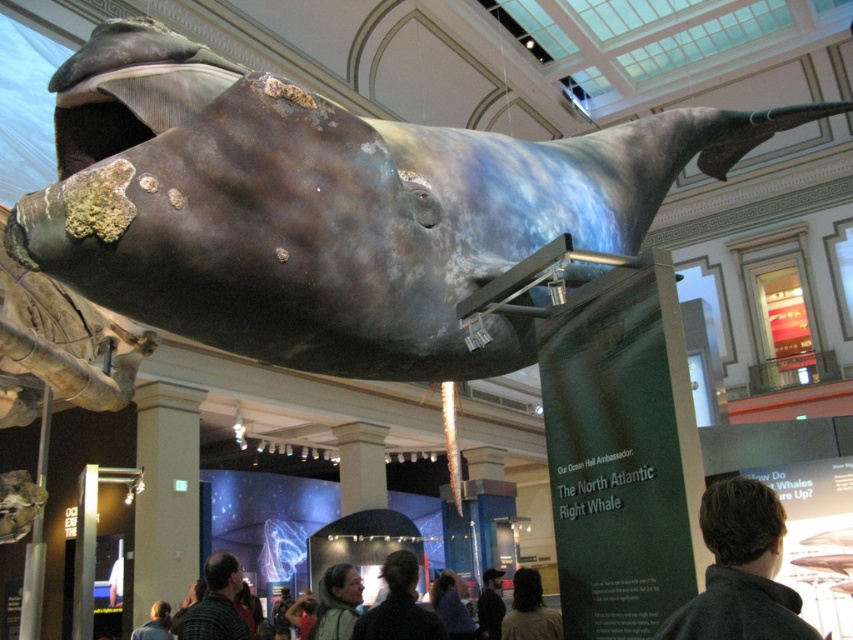
Can you confirm if shiny dark gray whale at center is thinner than blue-gray fabric jacket at center?

No, shiny dark gray whale at center is not thinner than blue-gray fabric jacket at center.

How much distance is there between shiny dark gray whale at center and blue-gray fabric jacket at center?

shiny dark gray whale at center is 18.58 meters away from blue-gray fabric jacket at center.

Which is behind, point (445, 316) or point (459, 592)?

The point (459, 592) is more distant.

You are a GUI agent. You are given a task and a screenshot of the screen. Output one action in this format:
    pyautogui.click(x=<x>, y=<y>)
    Task: Click on the shiny dark gray whale at center
    This screenshot has height=640, width=853.
    Given the screenshot: What is the action you would take?
    click(328, 208)

Who is higher up, dark brown leather jacket at center or dark brown hair at lower center?

dark brown hair at lower center is above.

Does dark brown leather jacket at center have a smaller size compared to dark brown hair at lower center?

Incorrect, dark brown leather jacket at center is not smaller in size than dark brown hair at lower center.

Between point (492, 576) and point (164, 625), which one is positioned behind?

The point (492, 576) is more distant.

Locate an element on the screen. Image resolution: width=853 pixels, height=640 pixels. dark brown leather jacket at center is located at coordinates [x=490, y=604].

Between dark gray sweater at center and blue-gray fabric jacket at center, which one appears on the right side from the viewer's perspective?

Positioned to the right is dark gray sweater at center.

Can you confirm if dark gray sweater at center is positioned below blue-gray fabric jacket at center?

No.

Locate an element on the screen. dark gray sweater at center is located at coordinates (740, 570).